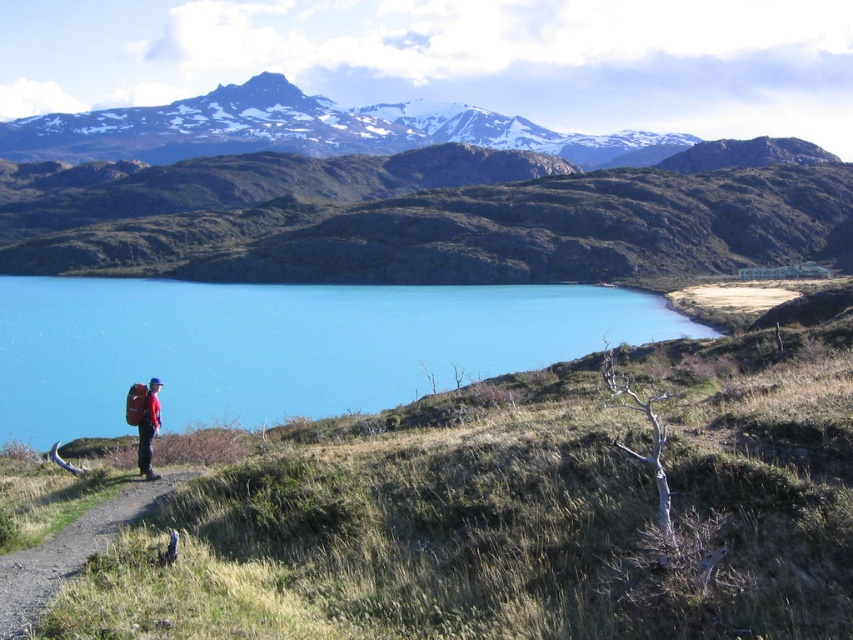
Who is higher up, blue glassy water at center or matte red backpack at lower left?

blue glassy water at center is higher up.

Can you confirm if blue glassy water at center is taller than matte red backpack at lower left?

Yes, blue glassy water at center is taller than matte red backpack at lower left.

Locate an element on the screen. The height and width of the screenshot is (640, 853). blue glassy water at center is located at coordinates (283, 346).

Locate an element on the screen. The image size is (853, 640). blue glassy water at center is located at coordinates (283, 346).

Can you confirm if blue glassy water at center is positioned to the left of dirt path at lower left?

Yes, blue glassy water at center is to the left of dirt path at lower left.

What do you see at coordinates (283, 346) in the screenshot? I see `blue glassy water at center` at bounding box center [283, 346].

The width and height of the screenshot is (853, 640). What are the coordinates of `blue glassy water at center` in the screenshot? It's located at (283, 346).

Does point (41, 579) come closer to viewer compared to point (155, 385)?

Yes, point (41, 579) is closer to viewer.

Is point (91, 547) less distant than point (149, 394)?

Yes, point (91, 547) is in front of point (149, 394).

I want to click on dirt path at lower left, so 68,552.